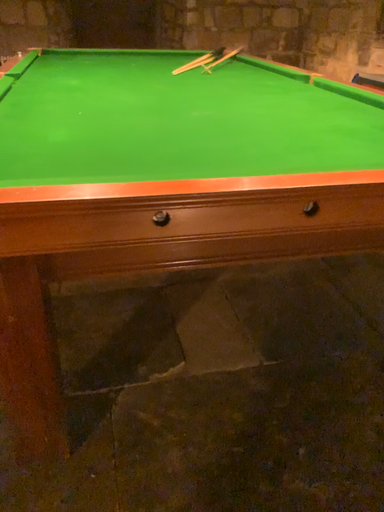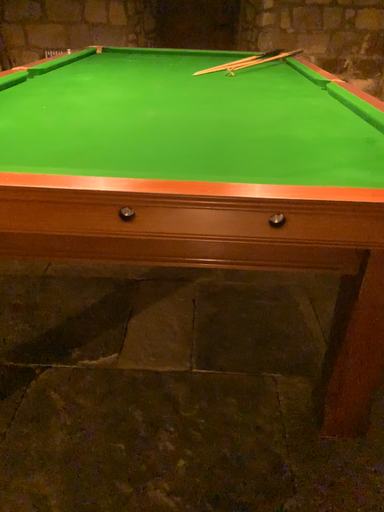
Question: Which way did the camera rotate in the video?

Choices:
 (A) rotated right
 (B) rotated left

Answer: (B)